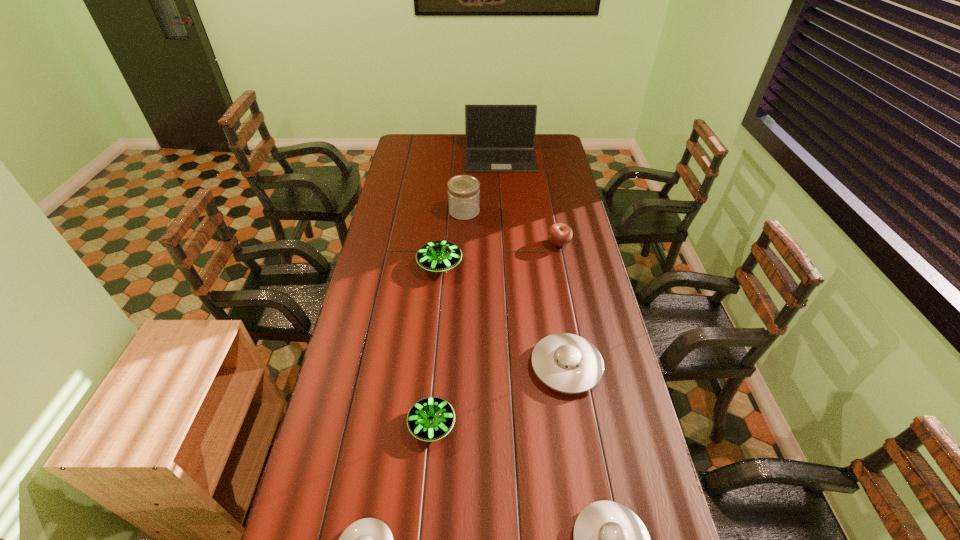
Locate an element on the screen. laptop is located at coordinates (499, 138).

Locate an element on the screen. The height and width of the screenshot is (540, 960). the farthest object is located at coordinates pos(499,138).

This screenshot has width=960, height=540. Identify the location of the seventh shortest object. (463, 190).

At what (x,y) coordinates should I click in order to perform the action: click on the second farthest object. Please return your answer as a coordinate pair (x, y). Looking at the image, I should click on (463, 190).

At what (x,y) coordinates should I click in order to perform the action: click on the farther green saucer. Please return your answer as a coordinate pair (x, y). Looking at the image, I should click on coord(437,256).

You are a GUI agent. You are given a task and a screenshot of the screen. Output one action in this format:
    pyautogui.click(x=<x>, y=<y>)
    Task: Click on the tallest saucer
    The height and width of the screenshot is (540, 960).
    Given the screenshot: What is the action you would take?
    (x=437, y=256)

Where is `apple`? apple is located at coordinates 560,234.

Find the location of a particular element. Image resolution: width=960 pixels, height=540 pixels. the fourth nearest saucer is located at coordinates (567, 363).

Locate an element on the screen. Image resolution: width=960 pixels, height=540 pixels. the fifth farthest object is located at coordinates (567, 363).

Identify the location of the third nearest saucer. (430, 419).